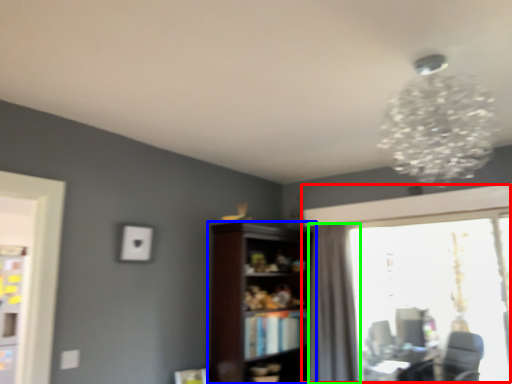
Question: Considering the real-world distances, which object is closest to window (highlighted by a red box)? shelf (highlighted by a blue box) or curtain (highlighted by a green box).

Choices:
 (A) shelf
 (B) curtain

Answer: (B)